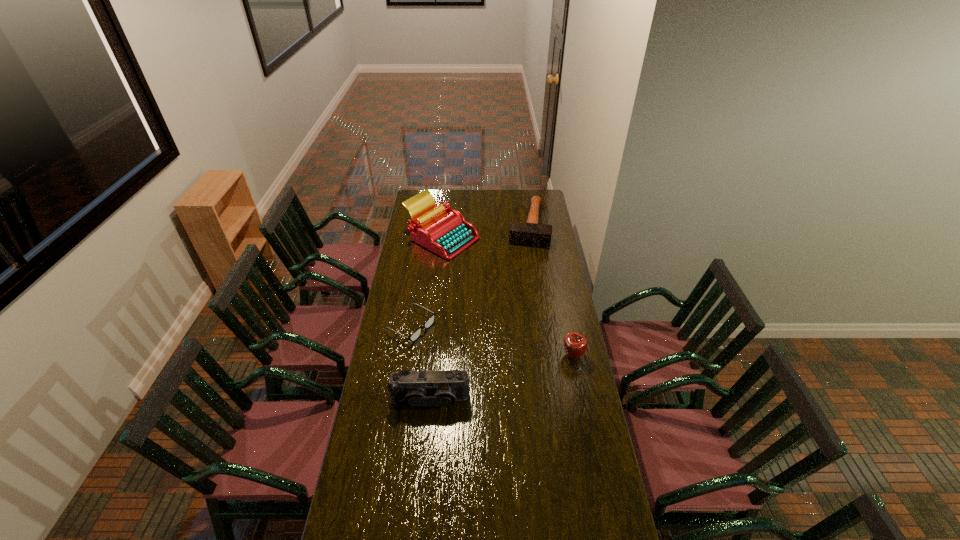
Where is `spectacles at the left edge`? Image resolution: width=960 pixels, height=540 pixels. spectacles at the left edge is located at coordinates (414, 336).

The height and width of the screenshot is (540, 960). I want to click on typewriter located in the left edge section of the desktop, so click(x=444, y=231).

Where is `apple at the right edge`? The height and width of the screenshot is (540, 960). apple at the right edge is located at coordinates (575, 344).

Where is `mallet located in the right edge section of the desktop`? The width and height of the screenshot is (960, 540). mallet located in the right edge section of the desktop is located at coordinates (530, 233).

I want to click on object present at the far right corner, so click(x=530, y=233).

I want to click on free spot at the left edge of the desktop, so click(x=409, y=251).

Where is `vacant space at the right edge`? vacant space at the right edge is located at coordinates (574, 325).

Locate an element on the screen. The image size is (960, 540). free space at the far right corner of the desktop is located at coordinates (526, 199).

Image resolution: width=960 pixels, height=540 pixels. What are the coordinates of `blank region between the shortest object and the third shortest object` in the screenshot? It's located at (492, 341).

Locate an element on the screen. The image size is (960, 540). free space between the camcorder and the tallest object is located at coordinates (436, 319).